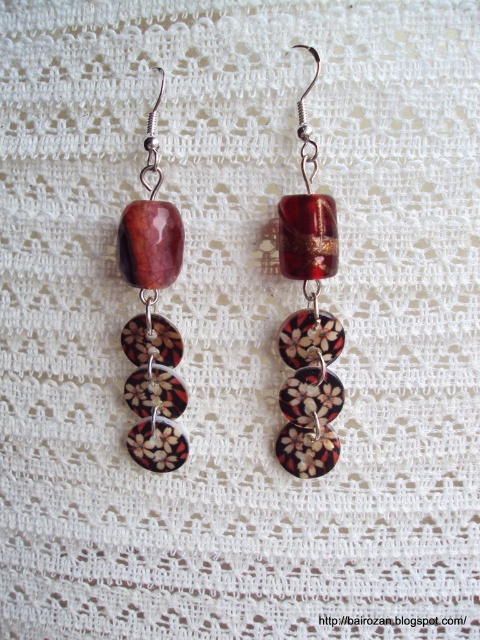
Question: Is matte floral-patterned disc at center to the left of matte brown stone at center from the viewer's perspective?

Choices:
 (A) no
 (B) yes

Answer: (A)

Question: Can you confirm if matte floral-patterned disc at center is smaller than matte brown stone at center?

Choices:
 (A) no
 (B) yes

Answer: (A)

Question: Does matte floral-patterned disc at center have a larger size compared to matte brown stone at center?

Choices:
 (A) yes
 (B) no

Answer: (A)

Question: Among these objects, which one is farthest from the camera?

Choices:
 (A) matte brown stone at center
 (B) matte floral-patterned disc at center

Answer: (A)

Question: Which of the following is the farthest from the observer?

Choices:
 (A) (152, 252)
 (B) (314, 147)

Answer: (A)

Question: Which point is closer to the camera?

Choices:
 (A) matte floral-patterned disc at center
 (B) matte brown stone at center

Answer: (A)